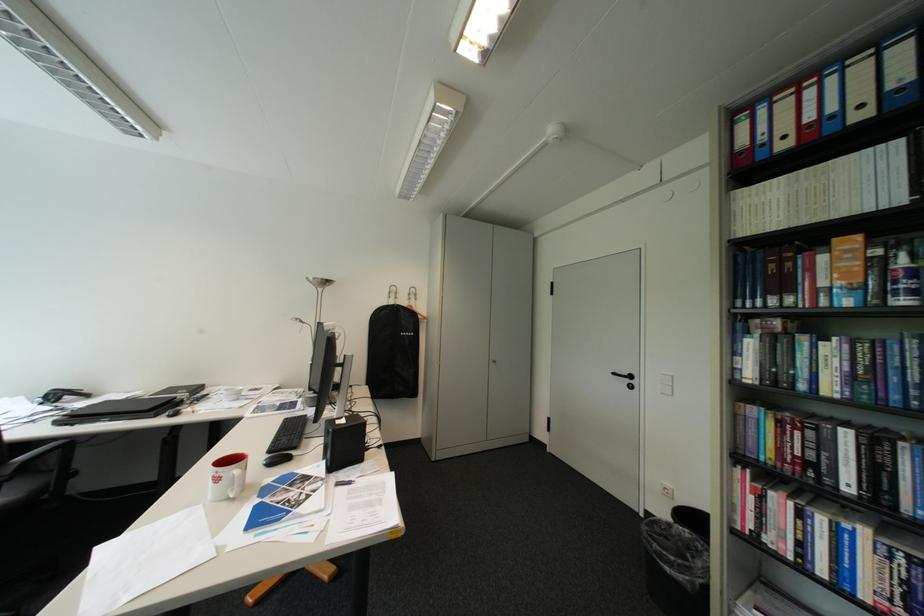
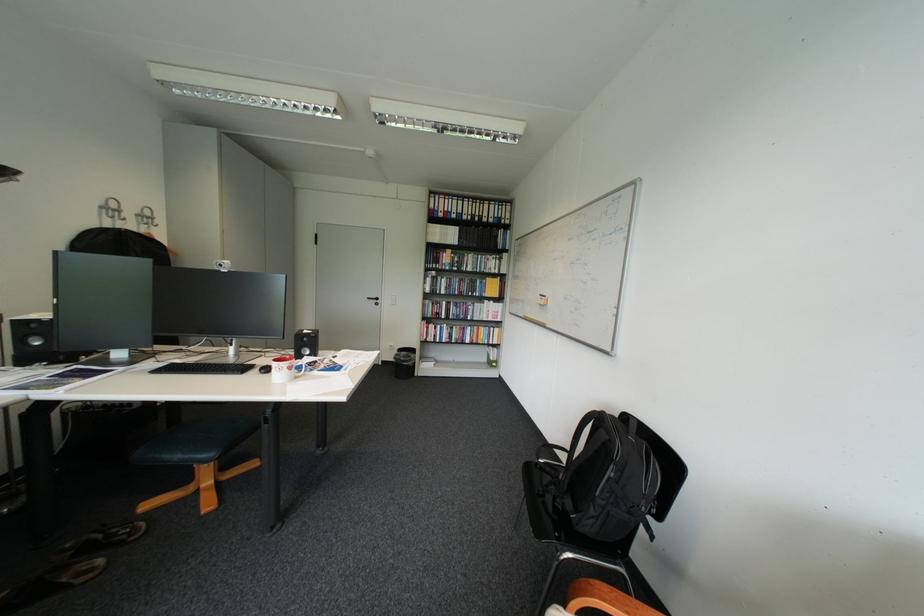
The point at (x=626, y=374) is marked in the first image. Where is the corresponding point in the second image?

(381, 299)